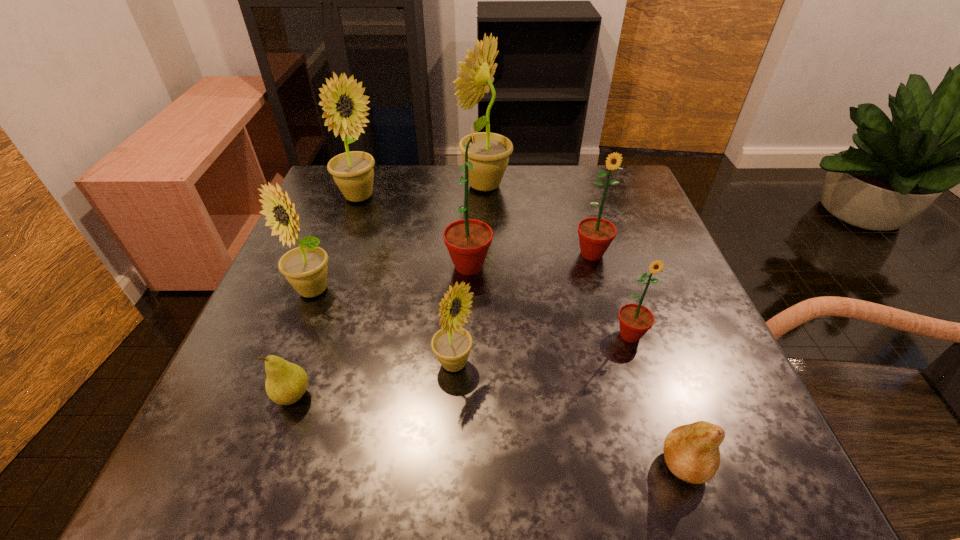
Locate an element on the screen. The image size is (960, 540). the tallest object is located at coordinates (492, 151).

Where is `the biggest yellow sunflower`? The height and width of the screenshot is (540, 960). the biggest yellow sunflower is located at coordinates (492, 151).

Locate an element on the screen. the second biggest yellow sunflower is located at coordinates (353, 173).

This screenshot has width=960, height=540. What are the coordinates of `the biggest green sunflower` in the screenshot? It's located at (468, 240).

What are the coordinates of `the second smallest green sunflower` in the screenshot? It's located at (595, 234).

Locate an element on the screen. This screenshot has width=960, height=540. the second smallest yellow sunflower is located at coordinates (305, 267).

The height and width of the screenshot is (540, 960). In order to click on the nearest yellow sunflower in this screenshot , I will do `click(452, 344)`.

In order to click on the smallest green sunflower in this screenshot , I will do `click(635, 320)`.

You are a GUI agent. You are given a task and a screenshot of the screen. Output one action in this format:
    pyautogui.click(x=<x>, y=<y>)
    Task: Click on the left pear
    The image size is (960, 540).
    Given the screenshot: What is the action you would take?
    pyautogui.click(x=286, y=383)

Locate an element on the screen. This screenshot has height=540, width=960. the nearer pear is located at coordinates [x=691, y=452].